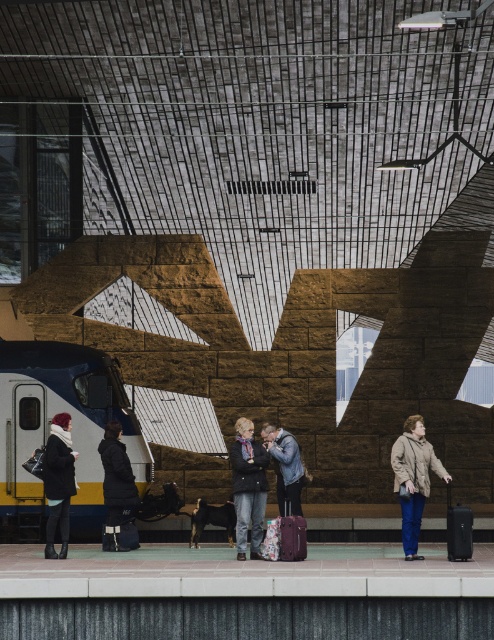
You are standing on the train station platform and see two points marked on the wall. The first point is at coordinates point (47, 465) and the second is at point (301, 525). Which point is closer to you?

Point (47, 465) is further to the viewer than point (301, 525). Therefore, the point closer to you is point (301, 525).

You are a traveler with a 5 feet wide luggage cart. You are standing between the blue metallic train at left and the beige wool coat at right. Can you move your cart through the space between them without touching either?

The distance between the blue metallic train at left and the beige wool coat at right is 17.36 feet. Since your cart is only 5 feet wide, there is sufficient space to move through the area without touching either object.

Consider the image. You are standing on the train station platform and see the blue metallic train at left. If you want to board the train, where should you walk towards based on its position?

The blue metallic train at left is located at point (48, 429), so you should walk towards the lower left area of the platform to board it.